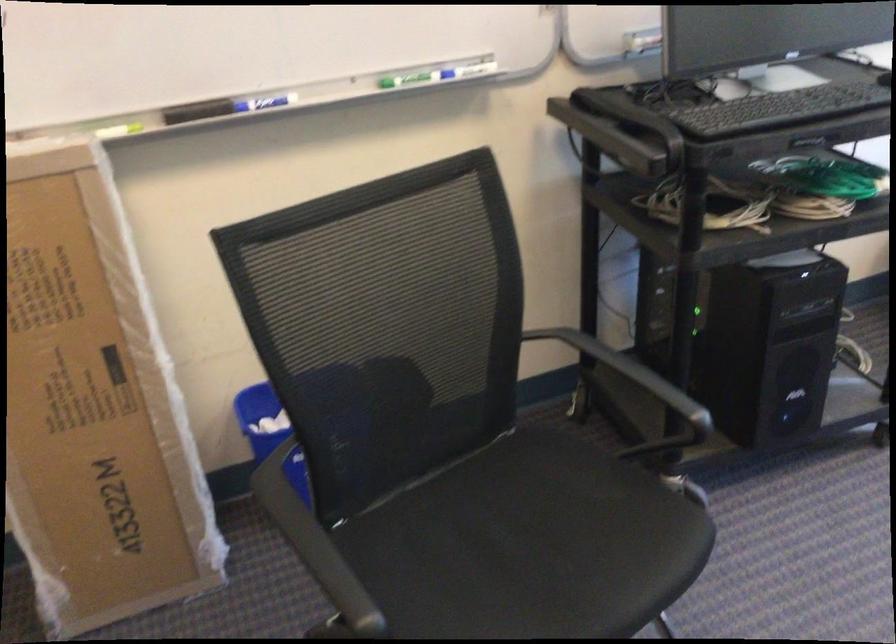
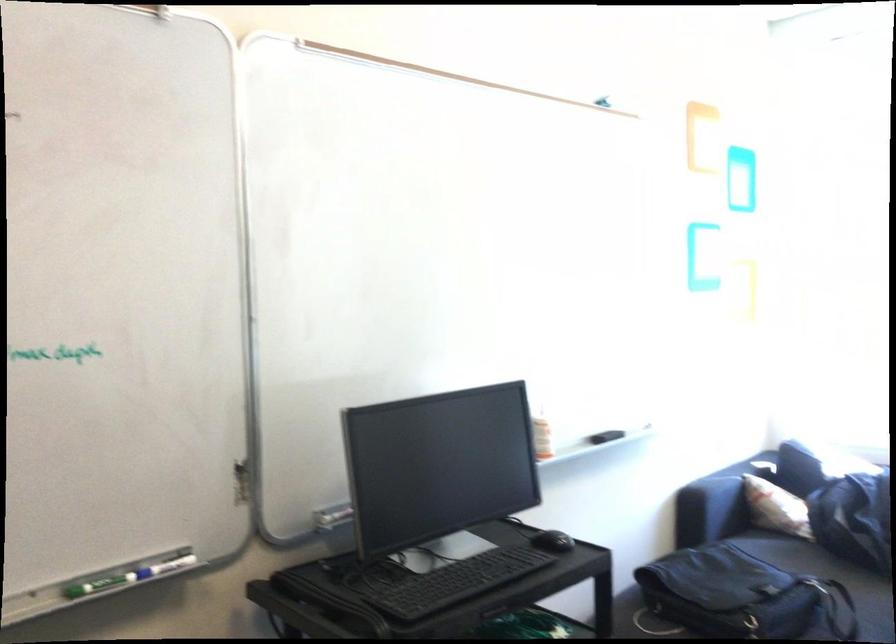
The point at (x=409, y=80) is marked in the first image. Where is the corresponding point in the second image?

(96, 585)